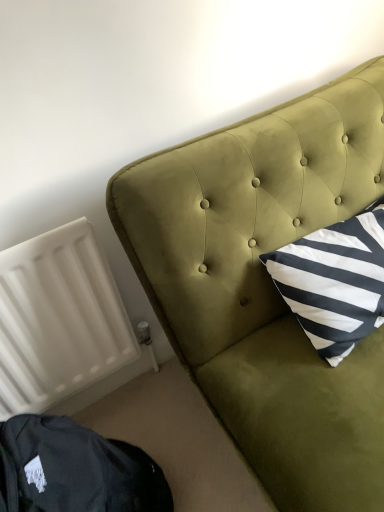
Question: Does dark green velvet bean bag chair at lower left have a lesser width compared to velvet green headboard at upper right?

Choices:
 (A) yes
 (B) no

Answer: (A)

Question: Is dark green velvet bean bag chair at lower left at the left side of velvet green headboard at upper right?

Choices:
 (A) no
 (B) yes

Answer: (B)

Question: Is dark green velvet bean bag chair at lower left completely or partially outside of velvet green headboard at upper right?

Choices:
 (A) yes
 (B) no

Answer: (A)

Question: Is dark green velvet bean bag chair at lower left touching velvet green headboard at upper right?

Choices:
 (A) no
 (B) yes

Answer: (A)

Question: From the image's perspective, does dark green velvet bean bag chair at lower left appear lower than velvet green headboard at upper right?

Choices:
 (A) no
 (B) yes

Answer: (B)

Question: Is dark green velvet bean bag chair at lower left taller than velvet green headboard at upper right?

Choices:
 (A) no
 (B) yes

Answer: (A)

Question: Is velvet green headboard at upper right smaller than white matte radiator at lower left?

Choices:
 (A) no
 (B) yes

Answer: (A)

Question: Considering the relative sizes of velvet green headboard at upper right and white matte radiator at lower left in the image provided, is velvet green headboard at upper right bigger than white matte radiator at lower left?

Choices:
 (A) no
 (B) yes

Answer: (B)

Question: Is velvet green headboard at upper right surrounding white matte radiator at lower left?

Choices:
 (A) yes
 (B) no

Answer: (B)

Question: From the image's perspective, is velvet green headboard at upper right below white matte radiator at lower left?

Choices:
 (A) yes
 (B) no

Answer: (B)

Question: Can you confirm if velvet green headboard at upper right is shorter than white matte radiator at lower left?

Choices:
 (A) no
 (B) yes

Answer: (A)

Question: Can you confirm if velvet green headboard at upper right is wider than white matte radiator at lower left?

Choices:
 (A) no
 (B) yes

Answer: (B)

Question: Considering the relative positions of dark green velvet bean bag chair at lower left and white matte radiator at lower left in the image provided, is dark green velvet bean bag chair at lower left to the left of white matte radiator at lower left from the viewer's perspective?

Choices:
 (A) no
 (B) yes

Answer: (A)